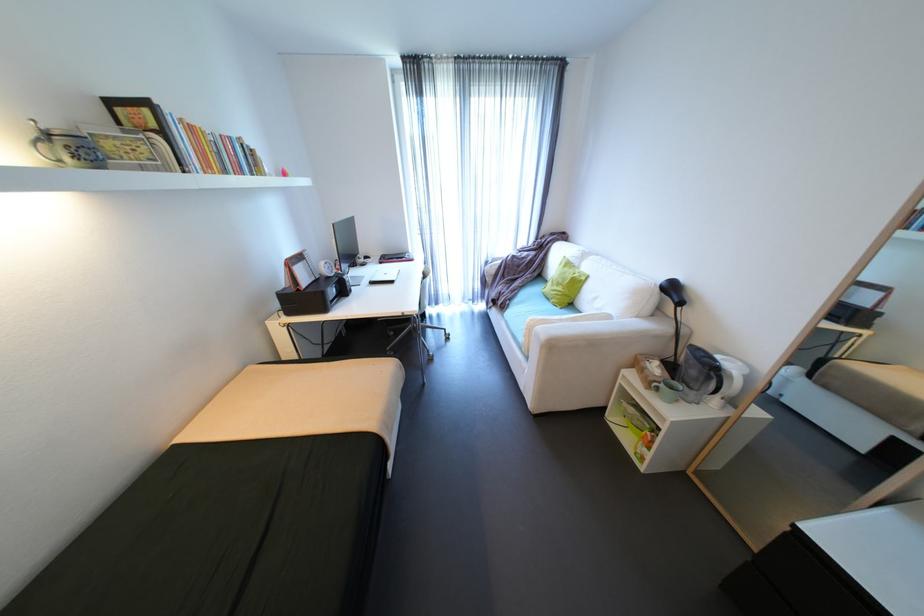
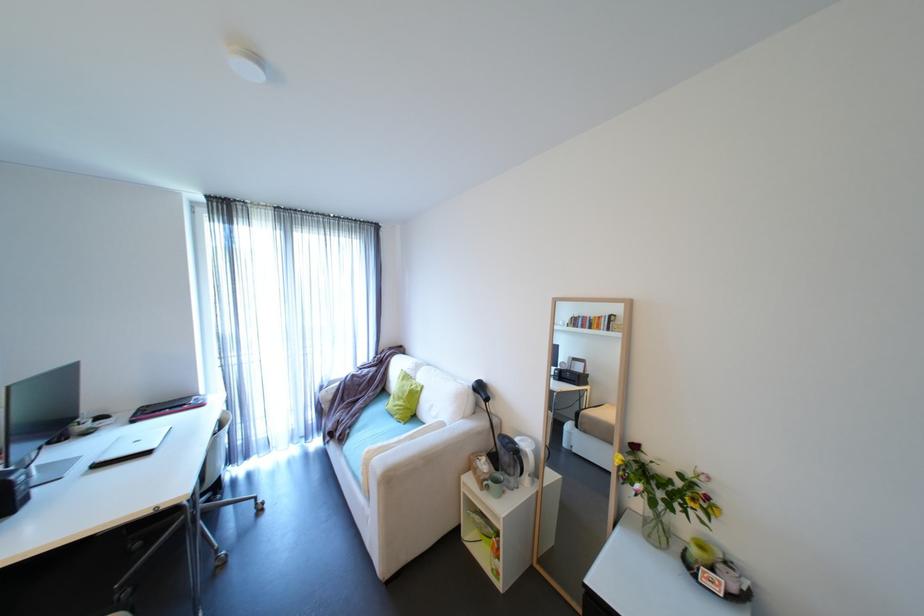
The point at (x=570, y=289) is marked in the first image. Where is the corresponding point in the second image?

(411, 402)